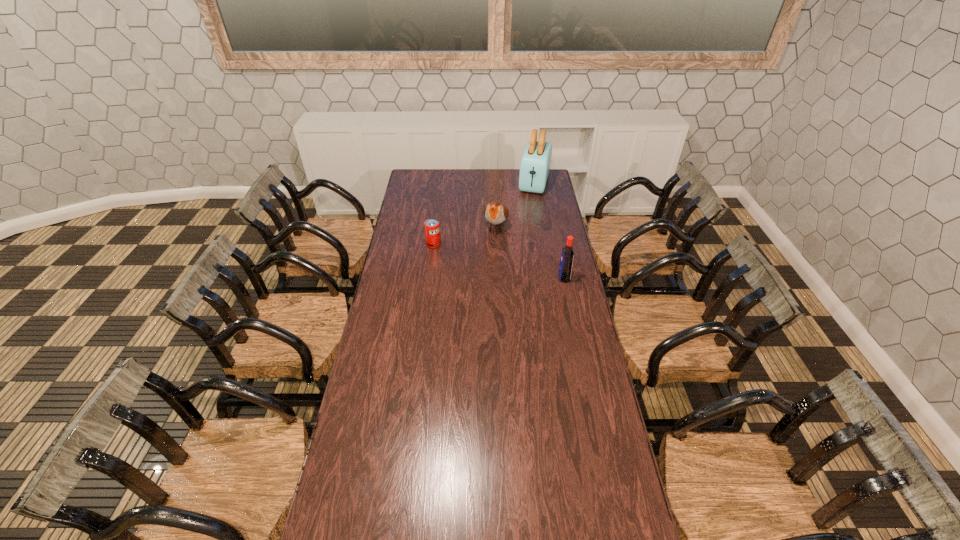
In the image, there is a desktop. Where is `vacant space at the near edge`? The width and height of the screenshot is (960, 540). vacant space at the near edge is located at coordinates (468, 508).

Image resolution: width=960 pixels, height=540 pixels. Find the location of `vacant space at the left edge`. vacant space at the left edge is located at coordinates (420, 225).

You are a GUI agent. You are given a task and a screenshot of the screen. Output one action in this format:
    pyautogui.click(x=<x>, y=<y>)
    Task: Click on the free space at the far left corner of the desktop
    This screenshot has height=540, width=960.
    Given the screenshot: What is the action you would take?
    pyautogui.click(x=420, y=172)

Where is `free region at the near right corner of the desktop`? The height and width of the screenshot is (540, 960). free region at the near right corner of the desktop is located at coordinates (578, 504).

Locate an element on the screen. This screenshot has width=960, height=540. vacant space in between the third nearest object and the can is located at coordinates (465, 235).

The width and height of the screenshot is (960, 540). Identify the location of vacant area that lies between the vodka and the leftmost object. (498, 261).

The image size is (960, 540). Find the location of `free space between the can and the vodka`. free space between the can and the vodka is located at coordinates (498, 261).

You are a GUI agent. You are given a task and a screenshot of the screen. Output one action in this format:
    pyautogui.click(x=<x>, y=<y>)
    Task: Click on the free space between the third nearest object and the shortest object
    This screenshot has width=960, height=540.
    Given the screenshot: What is the action you would take?
    pyautogui.click(x=465, y=235)

The image size is (960, 540). I want to click on empty space that is in between the tallest object and the shortest object, so click(x=484, y=214).

Identify the location of unoccupied area between the second object from left to right and the leftmost object. This screenshot has width=960, height=540. (465, 235).